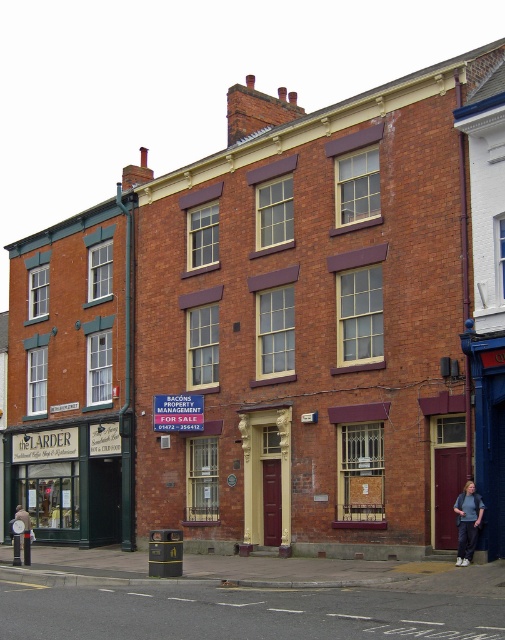
You are standing on the street in front of the three story brick building. You see two points marked on the building facade. The first point is at coordinate point (25,476) and the second point is at coordinate point (472,540). Which point is closer to you?

Point (25,476) is closer to you because it is further to the viewer than point (472,540).

You are a delivery person trying to locate the entrance to The Larder. You see a green wood signboard at lower left and denim pants at lower right. Which object is closer to the entrance?

The green wood signboard at lower left is positioned under denim pants at lower right, so the signboard is closer to the entrance since it is underneath the pants.